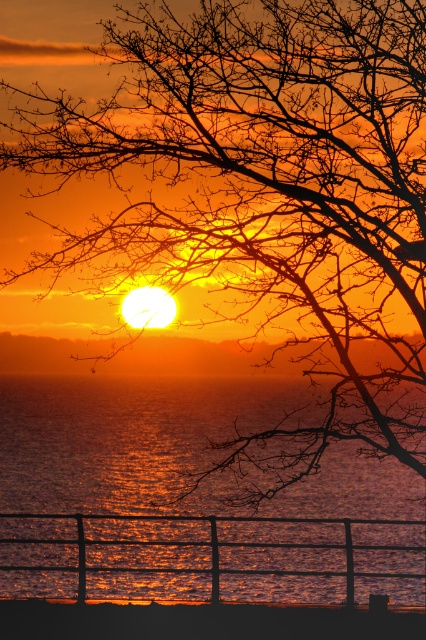
Is point (288, 561) closer to viewer compared to point (65, 342)?

Yes, point (288, 561) is closer to viewer.

Is glistening water at lower center to the right of orange matte horizon at center from the viewer's perspective?

Correct, you'll find glistening water at lower center to the right of orange matte horizon at center.

What are the coordinates of `glistening water at lower center` in the screenshot? It's located at (186, 499).